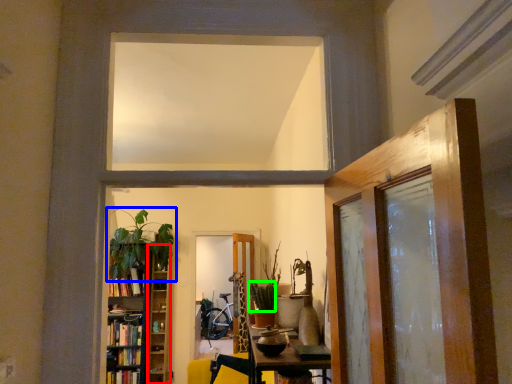
Question: Which object is the closest to the shelf (highlighted by a red box)? Choose among these: houseplant (highlighted by a blue box) or plant (highlighted by a green box).

Choices:
 (A) houseplant
 (B) plant

Answer: (A)